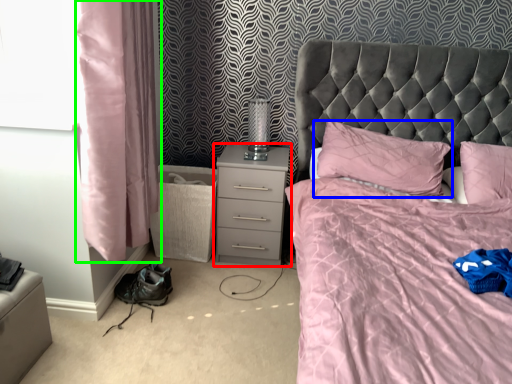
Question: Which object is positioned closest to nightstand (highlighted by a red box)? Select from pillow (highlighted by a blue box) and curtain (highlighted by a green box).

Choices:
 (A) pillow
 (B) curtain

Answer: (A)